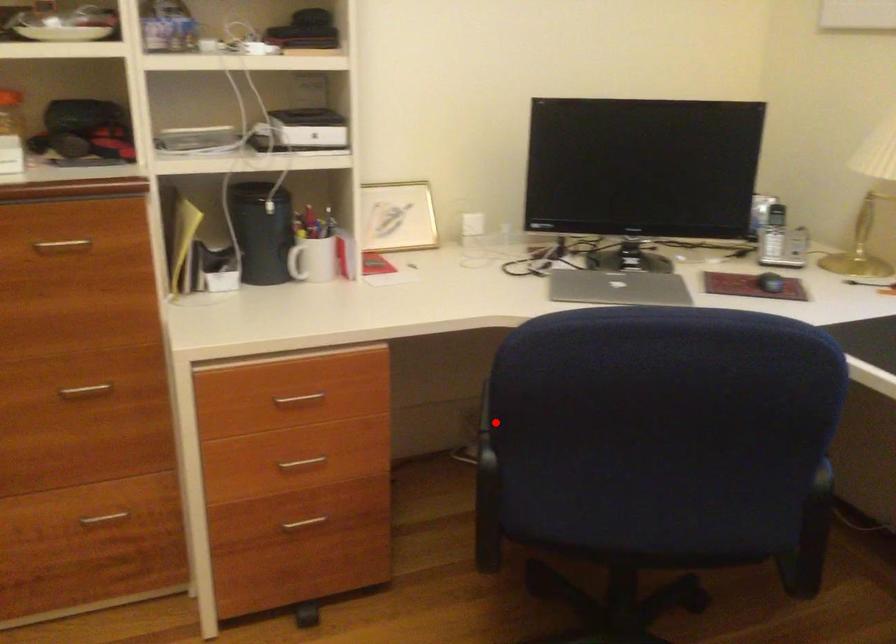
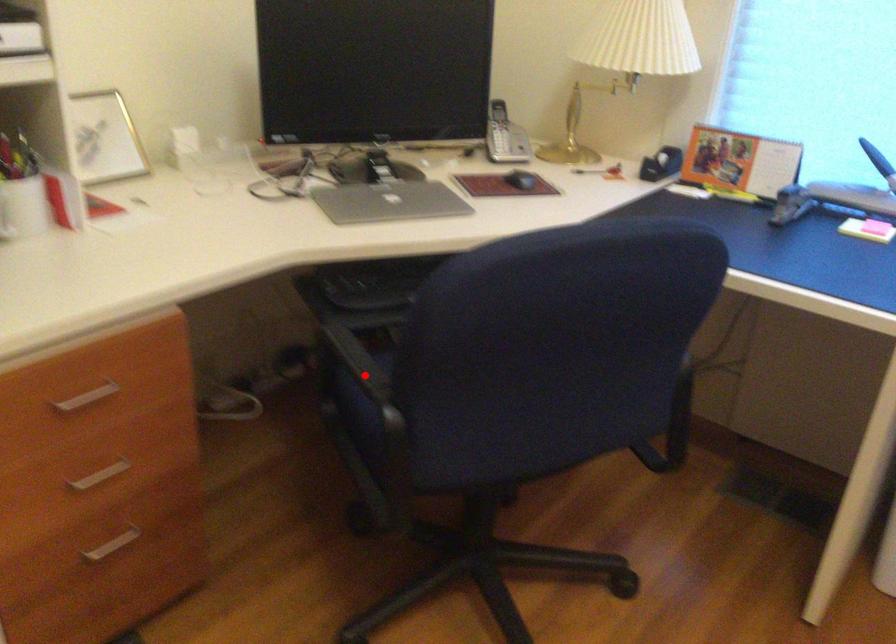
I am providing you with two images of the same scene from different viewpoints. A red point is marked on the first image and another point is marked on the second image. Are the points marked in image1 and image2 representing the same 3D position?

Yes